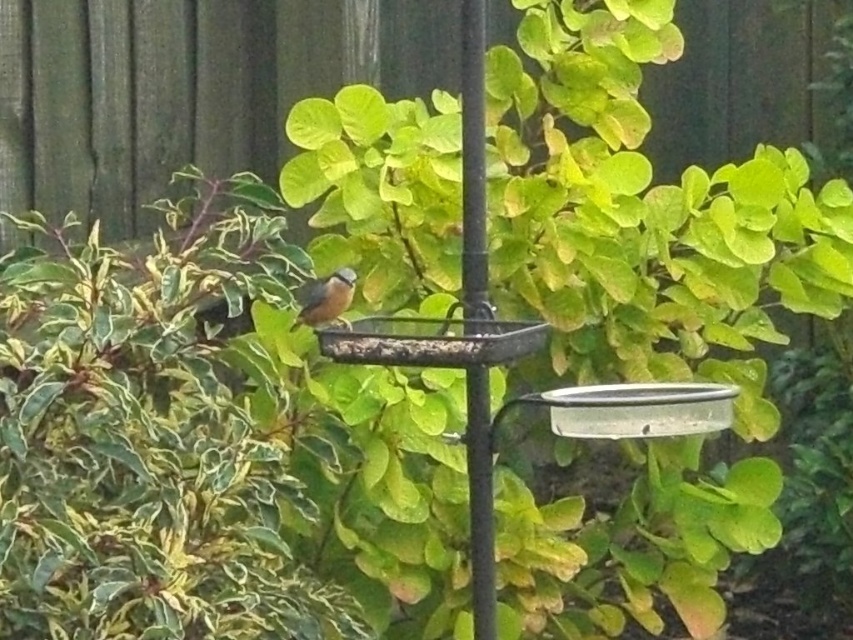
Does metallic silver bird feeder at center have a larger size compared to brown matte bird at center?

Yes, metallic silver bird feeder at center is bigger than brown matte bird at center.

Is point (448, 332) less distant than point (302, 304)?

Yes, point (448, 332) is closer to viewer.

In order to click on metallic silver bird feeder at center in this screenshot , I will do [431, 340].

Between point (474, 260) and point (383, 340), which one is positioned in front?

Point (383, 340) is in front.

Locate an element on the screen. black metal pole at center is located at coordinates (473, 172).

Describe the element at coordinates (473, 172) in the screenshot. I see `black metal pole at center` at that location.

The height and width of the screenshot is (640, 853). In order to click on black metal pole at center in this screenshot , I will do click(473, 172).

Does green leafy bush at center appear under black metal pole at center?

No, green leafy bush at center is not below black metal pole at center.

Does point (637, 584) come in front of point (480, 600)?

That is False.

Where is `green leafy bush at center`? The height and width of the screenshot is (640, 853). green leafy bush at center is located at coordinates (653, 227).